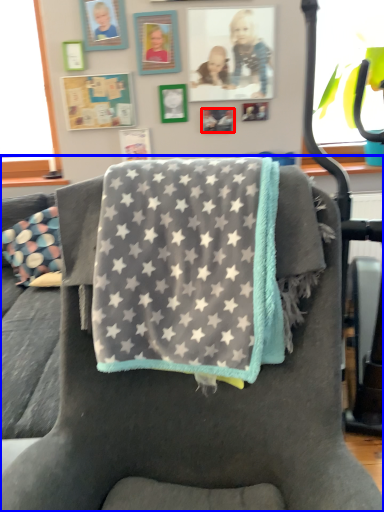
Question: Which of the following is the closest to the observer, picture frame (highlighted by a red box) or chair (highlighted by a blue box)?

Choices:
 (A) picture frame
 (B) chair

Answer: (B)